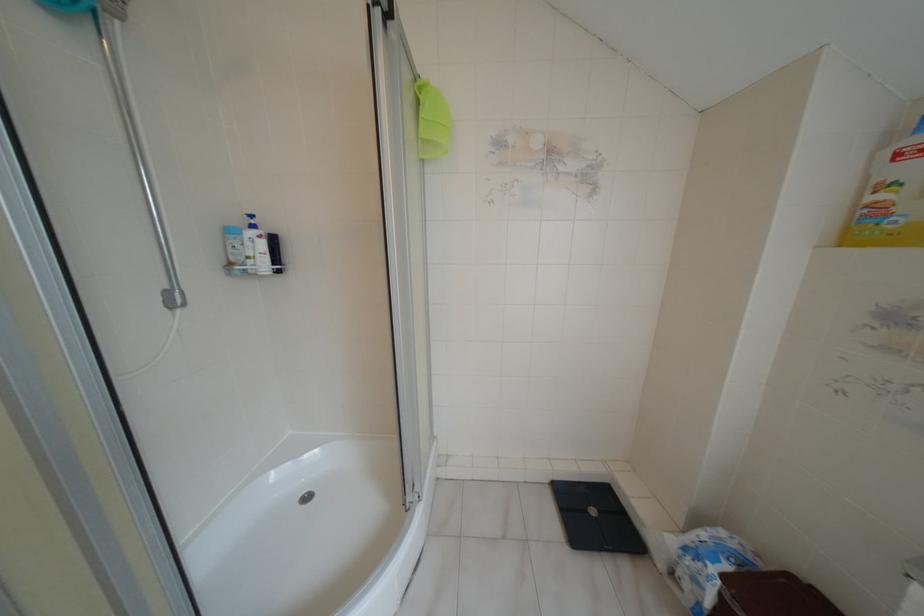
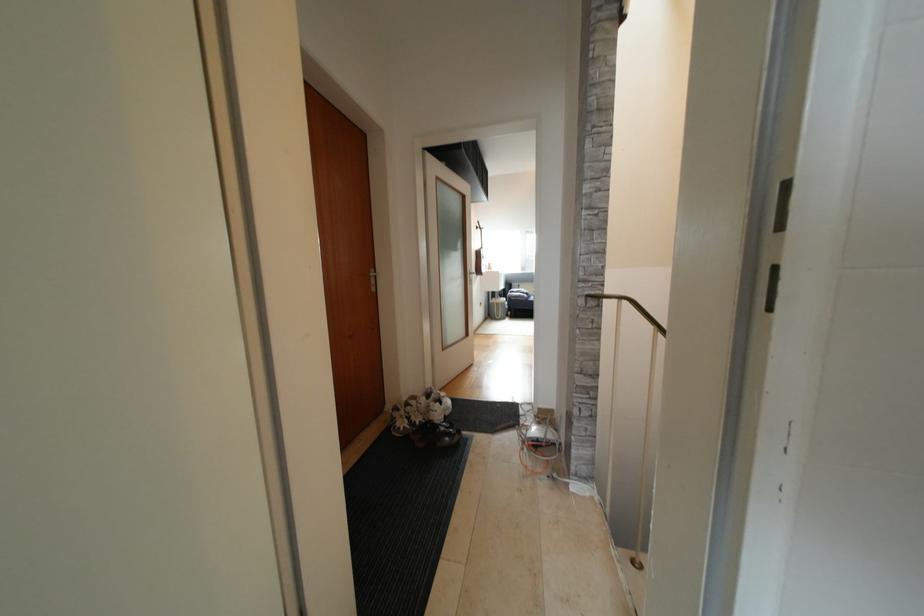
Question: The camera is either moving clockwise (left) or counter-clockwise (right) around the object. The first image is from the beginning of the video and the second image is from the end. Is the camera moving left or right when shooting the video?

Choices:
 (A) Left
 (B) Right

Answer: (B)